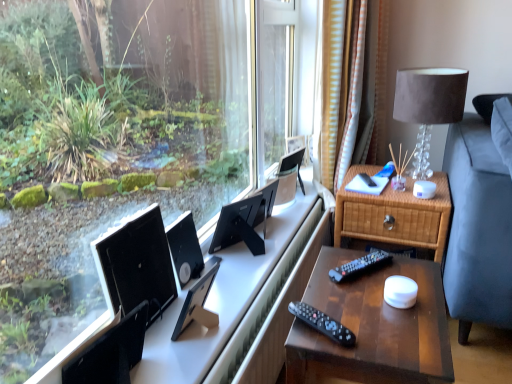
At what (x,y) coordinates should I click in order to perform the action: click on vacant area on the back side of matte black monitor at center, which appears as the second computer monitor when viewed from the front. Please return your answer as a coordinate pair (x, y). Image resolution: width=512 pixels, height=384 pixels. Looking at the image, I should click on (225, 291).